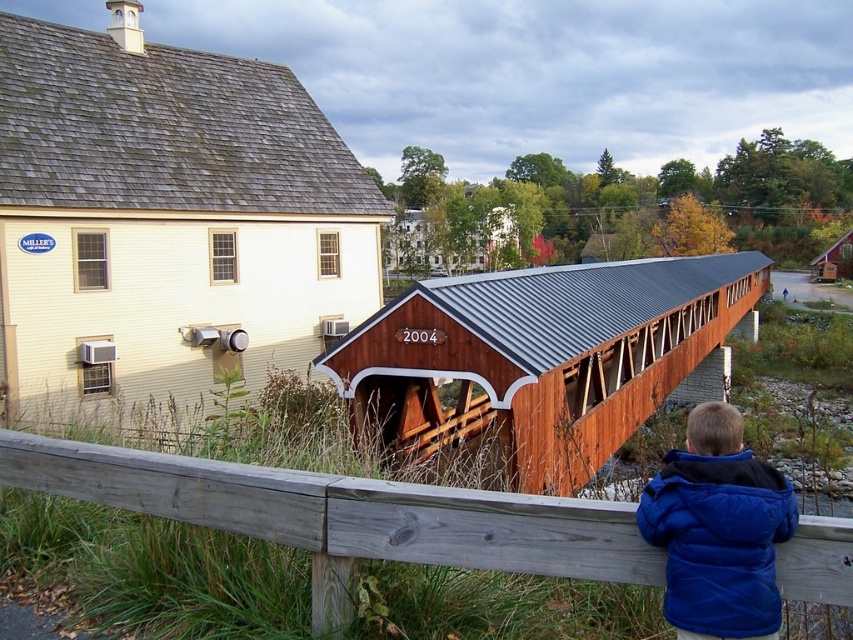
Question: Estimate the real-world distances between objects in this image. Which object is farther from the blue fleece jacket at lower right?

Choices:
 (A) gray wood fence at lower center
 (B) wooden bridge at center

Answer: (B)

Question: Can you confirm if wooden bridge at center is wider than gray wood fence at lower center?

Choices:
 (A) yes
 (B) no

Answer: (A)

Question: Which point is farther to the camera?

Choices:
 (A) blue fleece jacket at lower right
 (B) gray wood fence at lower center
 (C) wooden bridge at center

Answer: (C)

Question: Is wooden bridge at center bigger than gray wood fence at lower center?

Choices:
 (A) no
 (B) yes

Answer: (B)

Question: Estimate the real-world distances between objects in this image. Which object is farther from the wooden bridge at center?

Choices:
 (A) gray wood fence at lower center
 (B) blue fleece jacket at lower right

Answer: (B)

Question: Is wooden bridge at center to the right of gray wood fence at lower center from the viewer's perspective?

Choices:
 (A) no
 (B) yes

Answer: (B)